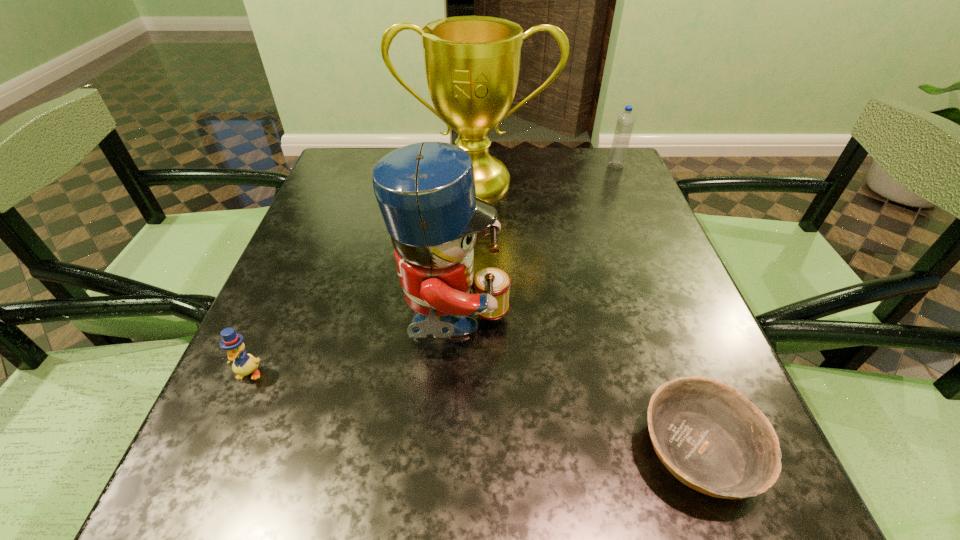
The image size is (960, 540). Find the location of `free spot between the third shortest object and the nutcracker`. free spot between the third shortest object and the nutcracker is located at coordinates (535, 246).

Locate an element on the screen. empty space that is in between the duckling and the nearest object is located at coordinates (473, 411).

Locate an element on the screen. Image resolution: width=960 pixels, height=540 pixels. free space between the duckling and the shortest object is located at coordinates (473, 411).

Where is `unoccupied position between the nutcracker and the shortest object`? This screenshot has height=540, width=960. unoccupied position between the nutcracker and the shortest object is located at coordinates pyautogui.click(x=576, y=388).

Select which object is the closest to the award. Please provide its 2D coordinates. Your answer should be formatted as a tuple, i.e. [(x, y)], where the tuple contains the x and y coordinates of a point satisfying the conditions above.

[(625, 122)]

Where is `the second closest object to the nearest object`? the second closest object to the nearest object is located at coordinates (472, 63).

Where is `vacant region that satisfies the following two spatial constraints: 1. on the front-facing side of the nutcracker; 2. on the face of the duckling, where the monocle is placed`? The image size is (960, 540). vacant region that satisfies the following two spatial constraints: 1. on the front-facing side of the nutcracker; 2. on the face of the duckling, where the monocle is placed is located at coordinates (450, 373).

Identify the location of free spot that satisfies the following two spatial constraints: 1. on the face of the fourth tallest object, where the monocle is placed; 2. on the right side of the bowl. (214, 450).

Where is `free point that satisfies the following two spatial constraints: 1. on the front-facing side of the nutcracker; 2. on the face of the duckling, where the monocle is placed`? free point that satisfies the following two spatial constraints: 1. on the front-facing side of the nutcracker; 2. on the face of the duckling, where the monocle is placed is located at coordinates (450, 373).

This screenshot has height=540, width=960. Find the location of `blank space that satisfies the following two spatial constraints: 1. on the shiny surface of the award; 2. on the front-facing side of the nutcracker`. blank space that satisfies the following two spatial constraints: 1. on the shiny surface of the award; 2. on the front-facing side of the nutcracker is located at coordinates (474, 326).